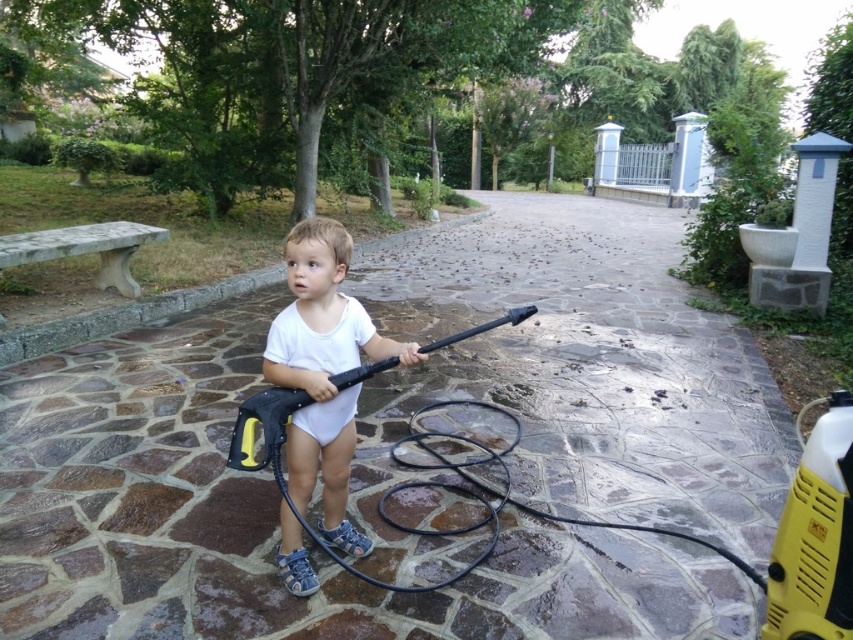
Who is taller, brown stone pavement at center or white matte onesie at center?

white matte onesie at center

Locate an element on the screen. The height and width of the screenshot is (640, 853). brown stone pavement at center is located at coordinates (270, 520).